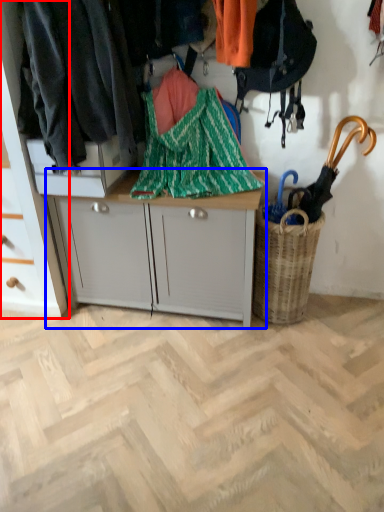
Question: Which of the following is the farthest to the observer, cabinetry (highlighted by a red box) or desk (highlighted by a blue box)?

Choices:
 (A) cabinetry
 (B) desk

Answer: (B)